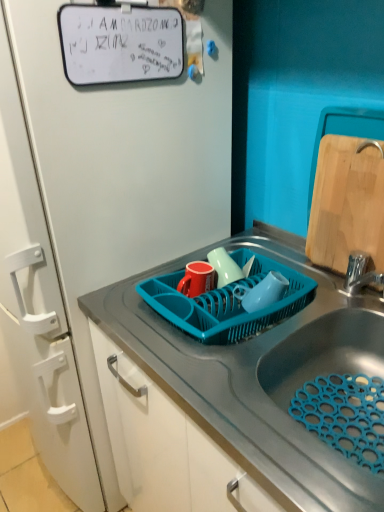
Question: Is wooden cutting board at right to the left of teal plastic dish rack at center from the viewer's perspective?

Choices:
 (A) no
 (B) yes

Answer: (A)

Question: From a real-world perspective, is wooden cutting board at right physically below teal plastic dish rack at center?

Choices:
 (A) no
 (B) yes

Answer: (A)

Question: Would you say teal plastic dish rack at center is part of wooden cutting board at right's contents?

Choices:
 (A) no
 (B) yes

Answer: (A)

Question: Does wooden cutting board at right have a greater height compared to teal plastic dish rack at center?

Choices:
 (A) no
 (B) yes

Answer: (B)

Question: Is wooden cutting board at right behind teal plastic dish rack at center?

Choices:
 (A) no
 (B) yes

Answer: (B)

Question: Can you confirm if wooden cutting board at right is wider than teal plastic dish rack at center?

Choices:
 (A) no
 (B) yes

Answer: (A)

Question: Can you confirm if teal plastic dish rack at center is smaller than wooden cutting board at right?

Choices:
 (A) no
 (B) yes

Answer: (A)

Question: Is teal plastic dish rack at center positioned in front of wooden cutting board at right?

Choices:
 (A) yes
 (B) no

Answer: (A)

Question: Can you confirm if teal plastic dish rack at center is wider than wooden cutting board at right?

Choices:
 (A) no
 (B) yes

Answer: (B)

Question: Does teal plastic dish rack at center appear on the right side of wooden cutting board at right?

Choices:
 (A) no
 (B) yes

Answer: (A)

Question: Is teal plastic dish rack at center not close to wooden cutting board at right?

Choices:
 (A) yes
 (B) no

Answer: (B)

Question: Is teal plastic dish rack at center oriented away from wooden cutting board at right?

Choices:
 (A) yes
 (B) no

Answer: (B)

Question: Does wooden cutting board at right have a lesser height compared to metallic sink at center?

Choices:
 (A) yes
 (B) no

Answer: (A)